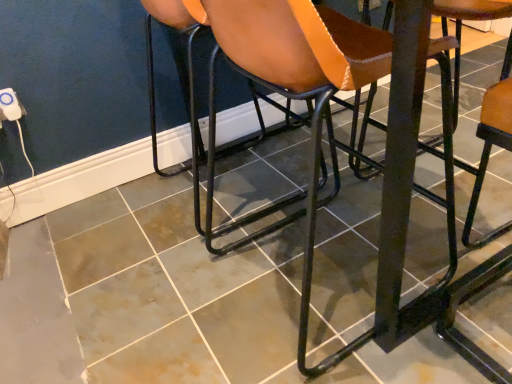
Identify the location of vacant region in front of brown leather chair at center, the 1th chair from the left. Image resolution: width=512 pixels, height=384 pixels. (168, 293).